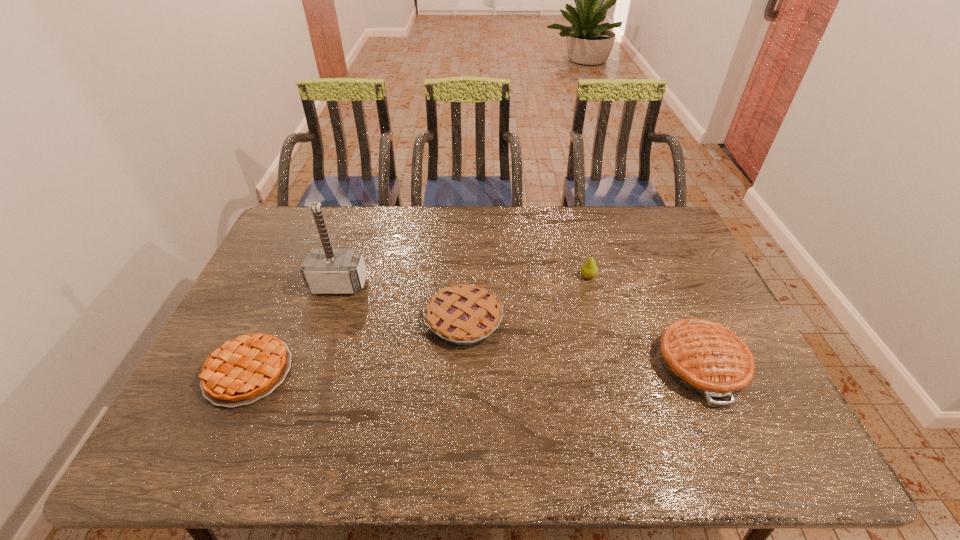
In order to click on vacant area between the tallest object and the second tallest pie in this screenshot , I will do `click(401, 302)`.

I want to click on object that stands as the third closest to the second object from right to left, so click(x=325, y=271).

Select which object appears as the second closest to the rightmost pie. Please provide its 2D coordinates. Your answer should be formatted as a tuple, i.e. [(x, y)], where the tuple contains the x and y coordinates of a point satisfying the conditions above.

[(464, 314)]

At what (x,y) coordinates should I click in order to perform the action: click on the second closest pie to the shortest pie. Please return your answer as a coordinate pair (x, y). Looking at the image, I should click on (708, 359).

Identify which pie is located as the nearest to the second tallest pie. Please provide its 2D coordinates. Your answer should be formatted as a tuple, i.e. [(x, y)], where the tuple contains the x and y coordinates of a point satisfying the conditions above.

[(243, 370)]

This screenshot has height=540, width=960. In order to click on vacant point that satisfies the following two spatial constraints: 1. for striking with the head of the hammer; 2. on the right side of the rightmost pie in this screenshot , I will do `click(312, 364)`.

At what (x,y) coordinates should I click in order to perform the action: click on vacant space that satisfies the following two spatial constraints: 1. on the back side of the third object from left to right; 2. on the left side of the shortest pie. Please return your answer as a coordinate pair (x, y). The width and height of the screenshot is (960, 540). Looking at the image, I should click on (273, 319).

What are the coordinates of `free point that satisfies the following two spatial constraints: 1. for striking with the head of the hammer; 2. on the right side of the third object from right to left` in the screenshot? It's located at (327, 319).